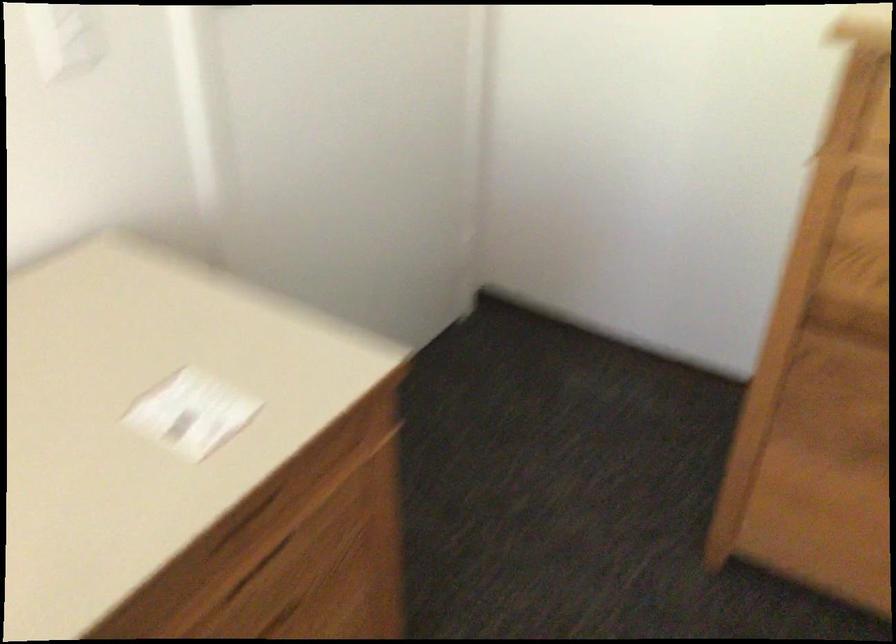
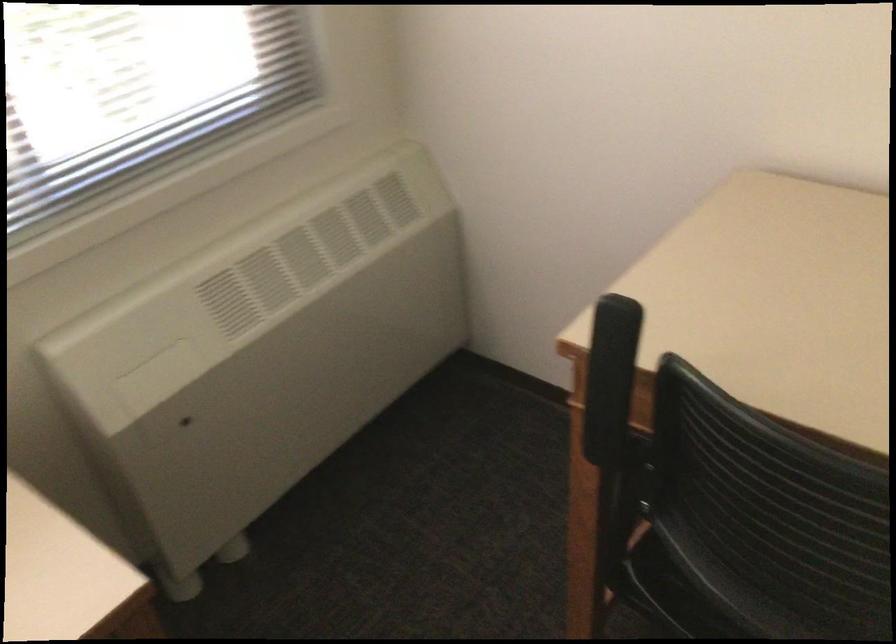
The first image is from the beginning of the video and the second image is from the end. How did the camera likely rotate when shooting the video?

The camera's rotation is toward left-down.